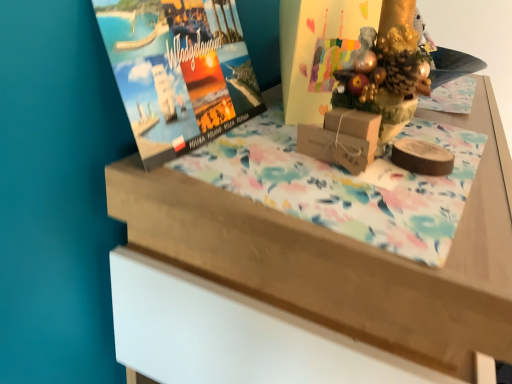
Find the location of a particular element. Image resolution: width=512 pixels, height=384 pixels. free region on the left part of brown cardboard box at center is located at coordinates (230, 162).